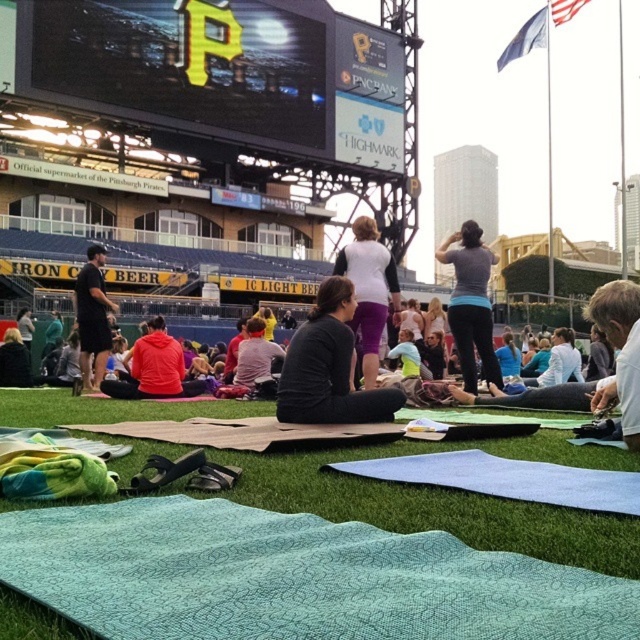
You are standing at the edge of the grassy field where the yoga session is happening. You want to reach a specific point marked at coordinates point (486, 273). If you can walk 1 meter per second, how long will it take you to reach that point?

The distance of point (486, 273) from viewer is 7.21 meters, so it will take approximately 7.21 seconds to reach the point since you walk at 1 meter per second.

You are a photographer positioned at the edge of the grassy field where the yoga session is happening. You want to take a photo of the light brown leather jacket at lower right without the black matte scoreboard at upper center blocking it. Is this possible?

The light brown leather jacket at lower right is behind the black matte scoreboard at upper center, so it is already blocked by the scoreboard. Therefore, you cannot take a photo of the light brown leather jacket at lower right without the scoreboard blocking it.